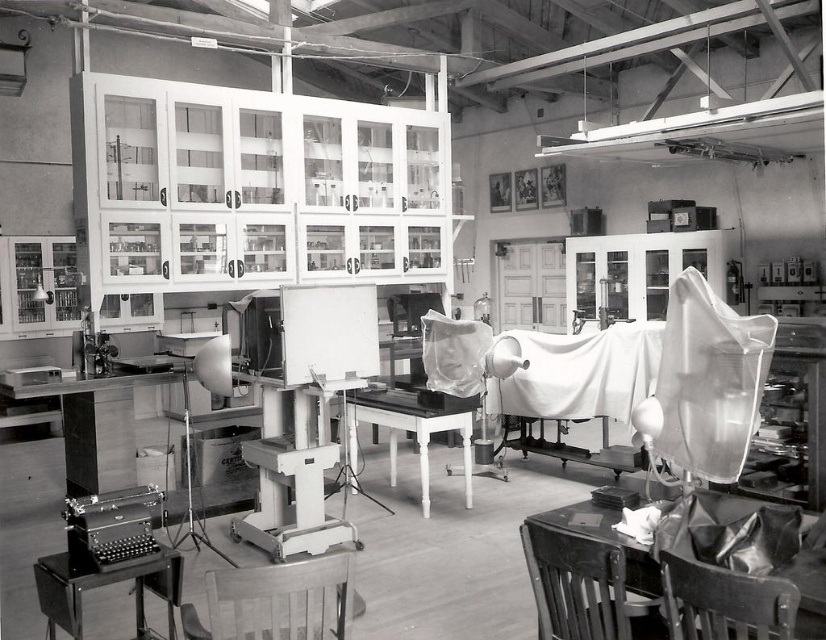
You are a visitor standing in the vintage laboratory. You need to sit down to take notes but want to choose the seat that is higher off the ground. Which object should you choose between the wooden chair at lower center and the metallic gray typewriter at lower left?

The wooden chair at lower center is taller than the metallic gray typewriter at lower left, so you should choose the wooden chair at lower center as it is higher off the ground.

Looking at this image, you are organizing a lab tour and need to seat a group of visitors. The dark wood chair at lower right and the smooth white table at center are available. Can you fit the chair comfortably at the table without overcrowding the space?

The dark wood chair at lower right is smaller than the smooth white table at center, so it should fit comfortably without overcrowding the space.

You are an assistant in the lab and need to move from the wooden chair at lower right to the metallic gray typewriter at lower left. Which direction should you move to reach it?

The wooden chair at lower right is positioned on the right side of the metallic gray typewriter at lower left, so you should move to the left to reach it.